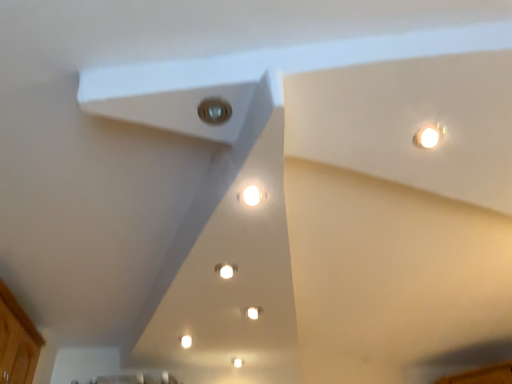
Question: Is wooden cabinet at lower left to the left of matte glass light at center, which is the 2th light in back-to-front order, from the viewer's perspective?

Choices:
 (A) no
 (B) yes

Answer: (B)

Question: Can you confirm if wooden cabinet at lower left is bigger than matte glass light at center, which is the 2th light from bottom to top?

Choices:
 (A) yes
 (B) no

Answer: (A)

Question: From the image's perspective, is wooden cabinet at lower left located beneath matte glass light at center, which is the 2th light in back-to-front order?

Choices:
 (A) no
 (B) yes

Answer: (B)

Question: Can you confirm if wooden cabinet at lower left is positioned to the right of matte glass light at center, arranged as the first light when viewed from the front?

Choices:
 (A) yes
 (B) no

Answer: (B)

Question: From the image's perspective, is wooden cabinet at lower left above matte glass light at center, which is the 2th light from bottom to top?

Choices:
 (A) no
 (B) yes

Answer: (A)

Question: From the image's perspective, relative to matte glass light at center, which is the 1th light from top to bottom, is wooden cabinet at lower left above or below?

Choices:
 (A) below
 (B) above

Answer: (A)

Question: Based on their sizes in the image, would you say wooden cabinet at lower left is bigger or smaller than matte glass light at center, which is the 2th light in back-to-front order?

Choices:
 (A) small
 (B) big

Answer: (B)

Question: Is wooden cabinet at lower left wider or thinner than matte glass light at center, which is the 2th light from bottom to top?

Choices:
 (A) thin
 (B) wide

Answer: (B)

Question: Would you say wooden cabinet at lower left is to the left or to the right of matte glass light at center, which is the 1th light from top to bottom, in the picture?

Choices:
 (A) left
 (B) right

Answer: (A)

Question: From a real-world perspective, is wooden cabinet at lower left above or below white glossy light at center, placed as the 1th light when sorted from back to front?

Choices:
 (A) above
 (B) below

Answer: (B)

Question: From the image's perspective, is wooden cabinet at lower left above or below white glossy light at center, marked as the second light in a front-to-back arrangement?

Choices:
 (A) above
 (B) below

Answer: (B)

Question: Is wooden cabinet at lower left situated inside white glossy light at center, the second light viewed from the top, or outside?

Choices:
 (A) inside
 (B) outside

Answer: (B)

Question: Is point (15, 344) positioned closer to the camera than point (227, 269)?

Choices:
 (A) closer
 (B) farther

Answer: (B)

Question: In the image, is white glossy light at center, which appears as the first light when ordered from the bottom, on the left side or the right side of matte glass light at center, which is the 1th light from top to bottom?

Choices:
 (A) right
 (B) left

Answer: (B)

Question: Relative to matte glass light at center, arranged as the first light when viewed from the front, is white glossy light at center, the second light viewed from the top, in front or behind?

Choices:
 (A) behind
 (B) front

Answer: (A)